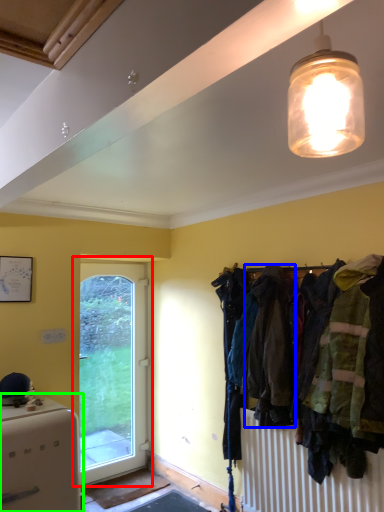
Question: Which is nearer to the door (highlighted by a red box)? clothing (highlighted by a blue box) or appliance (highlighted by a green box).

Choices:
 (A) clothing
 (B) appliance

Answer: (B)